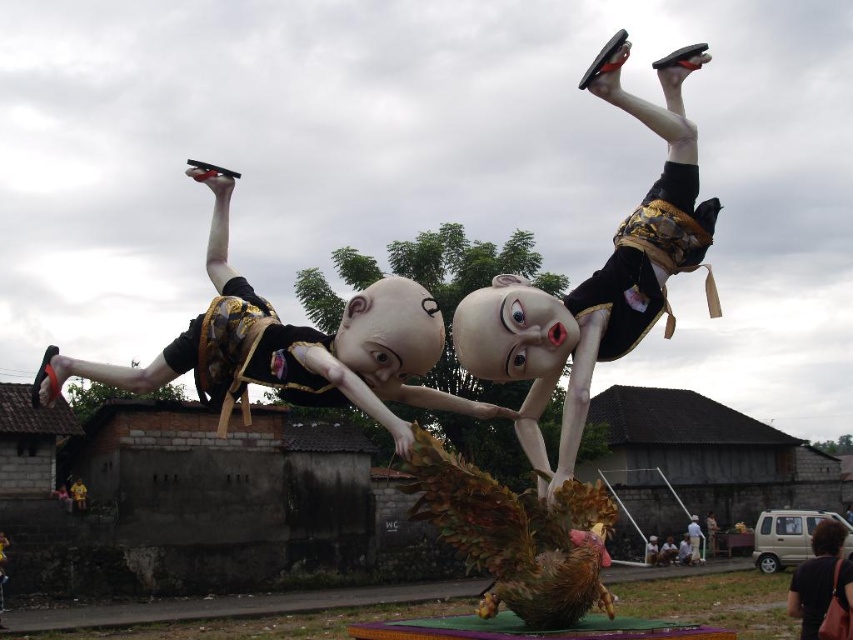
You are an observer looking at the scene. There are two figures, the matte black figure at upper center and the matte black figure at center. Which figure is positioned higher in the air?

The matte black figure at upper center is located above the matte black figure at center, so it is positioned higher in the air.

You are an art curator assessing the spatial arrangement of the displayed figures. Given that the matte black figure at left and the white matte person at center are suspended in midair, which one would cast a longer shadow on the ground below?

The matte black figure at left is much taller as white matte person at center, so it would cast a longer shadow on the ground below.